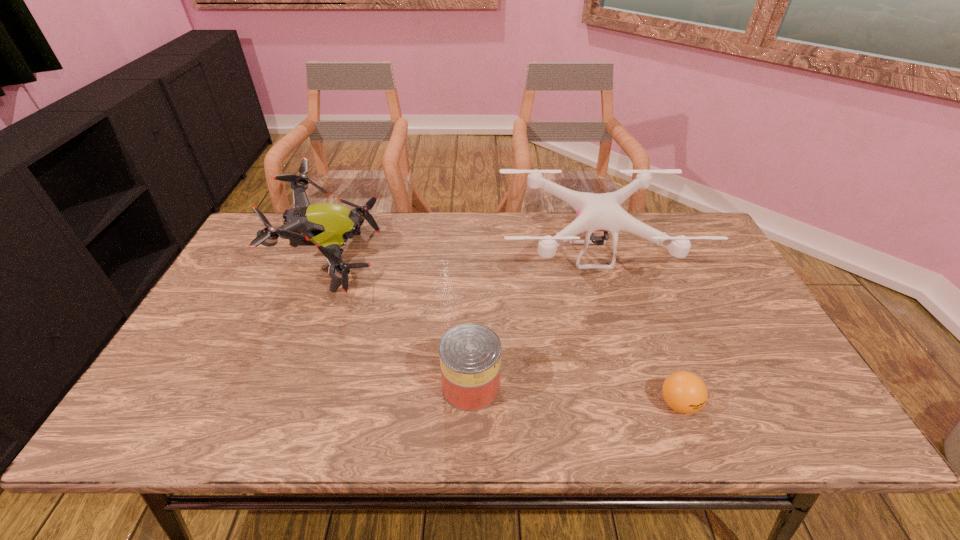
In the image, there is a desktop. Where is `vacant space at the near left corner`? This screenshot has height=540, width=960. vacant space at the near left corner is located at coordinates (168, 433).

I want to click on free spot at the far right corner of the desktop, so click(668, 215).

Image resolution: width=960 pixels, height=540 pixels. What are the coordinates of `vacant area that lies between the can and the left drone` in the screenshot? It's located at (402, 323).

The width and height of the screenshot is (960, 540). Identify the location of unoccupied position between the shortest object and the third object from right to left. pos(575,395).

Find the location of a particular element. This screenshot has width=960, height=540. unoccupied position between the second object from left to right and the second tallest object is located at coordinates 531,321.

Where is `unoccupied area between the second tallest object and the taller drone`? The width and height of the screenshot is (960, 540). unoccupied area between the second tallest object and the taller drone is located at coordinates (462, 257).

Find the location of `unoccupied position between the taller drone and the third shortest object`. unoccupied position between the taller drone and the third shortest object is located at coordinates (462, 257).

Locate an element on the screen. The width and height of the screenshot is (960, 540). free space that is in between the second object from left to right and the shortest object is located at coordinates tap(575, 395).

The height and width of the screenshot is (540, 960). I want to click on free spot between the right drone and the shortest object, so click(635, 329).

Find the location of a particular element. vacant space in between the second shortest object and the taller drone is located at coordinates (402, 323).